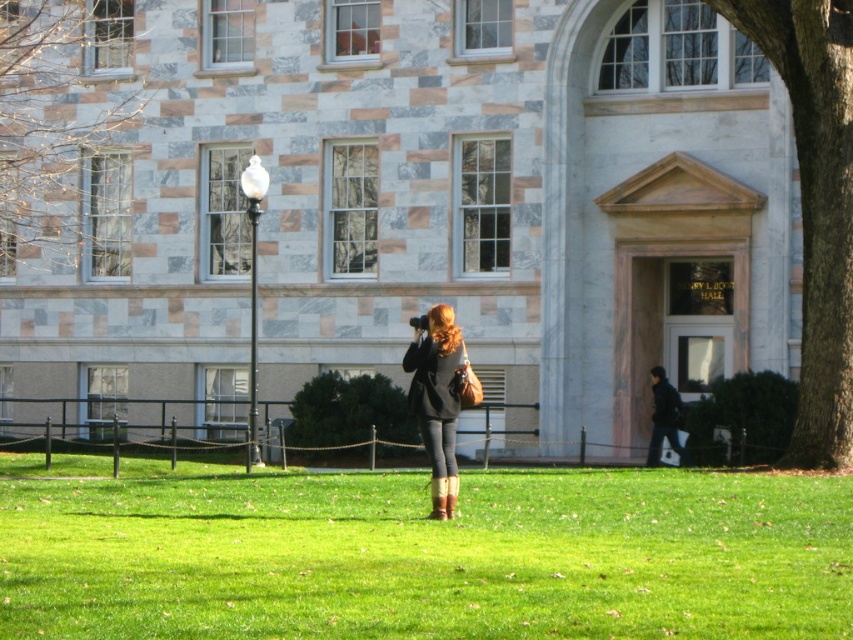
Question: Which is farther from the bare branches at upper left?

Choices:
 (A) green grass at center
 (B) matte black jacket at center
 (C) smooth brown bark at right

Answer: (C)

Question: Is bare branches at upper left above matte black jacket at center?

Choices:
 (A) yes
 (B) no

Answer: (A)

Question: Is green grass at center to the right of bare branches at upper left from the viewer's perspective?

Choices:
 (A) yes
 (B) no

Answer: (A)

Question: Which of the following is the farthest from the observer?

Choices:
 (A) (155, 516)
 (B) (810, 49)
 (C) (425, 417)
 (D) (122, 125)

Answer: (D)

Question: Which object is farther from the camera taking this photo?

Choices:
 (A) smooth brown bark at right
 (B) green grass at center
 (C) bare branches at upper left

Answer: (C)

Question: Can you confirm if smooth brown bark at right is wider than bare branches at upper left?

Choices:
 (A) yes
 (B) no

Answer: (B)